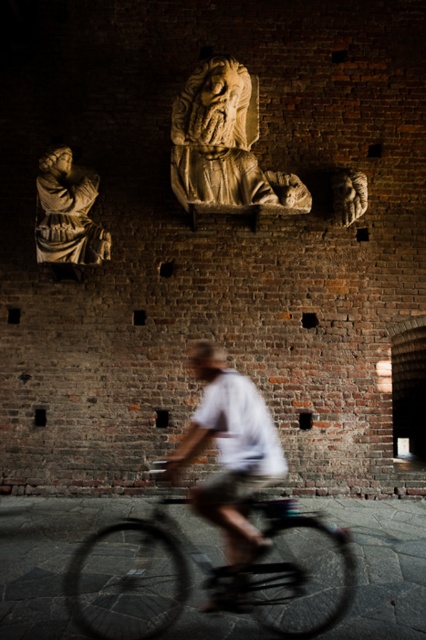
Question: Which object is the farthest from the metallic bicycle at center?

Choices:
 (A) beige stone sculpture at upper center
 (B) white matte shirt at center
 (C) matte stone statue at upper center

Answer: (A)

Question: Is beige stone sculpture at upper center above matte stone statue at upper center?

Choices:
 (A) yes
 (B) no

Answer: (A)

Question: Is white matte shirt at center to the left of matte stone statue at upper center from the viewer's perspective?

Choices:
 (A) no
 (B) yes

Answer: (A)

Question: Can you confirm if metallic bicycle at center is thinner than matte stone statue at upper center?

Choices:
 (A) yes
 (B) no

Answer: (B)

Question: Considering the real-world distances, which object is farthest from the white matte shirt at center?

Choices:
 (A) matte stone statue at upper center
 (B) metallic bicycle at center
 (C) beige stone sculpture at upper center

Answer: (C)

Question: Which is farther from the metallic bicycle at center?

Choices:
 (A) white matte shirt at center
 (B) beige stone sculpture at upper center
 (C) matte stone statue at upper center

Answer: (B)